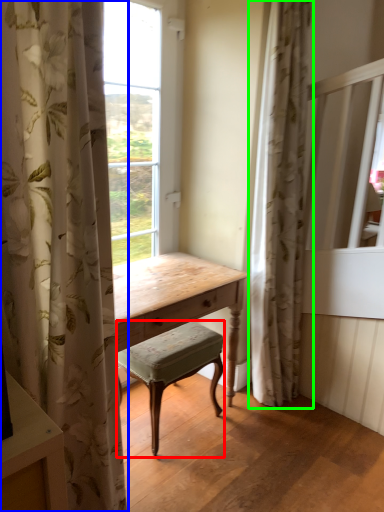
Question: Which object is the farthest from stool (highlighted by a red box)? Choose among these: curtain (highlighted by a blue box) or curtain (highlighted by a green box).

Choices:
 (A) curtain
 (B) curtain

Answer: (A)